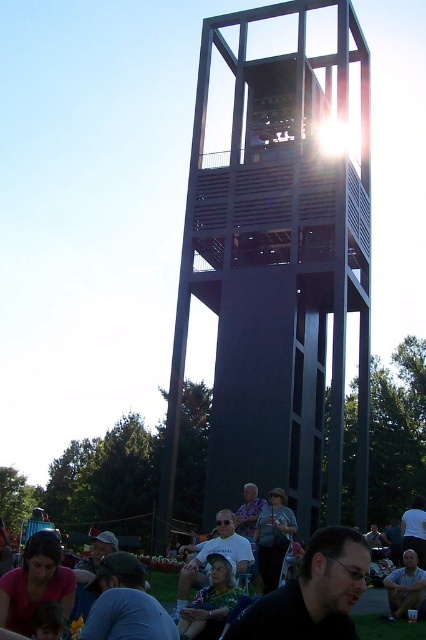
Can you confirm if floral fabric dress at lower center is shorter than matte gray shirt at center?

Yes.

What do you see at coordinates (210, 602) in the screenshot?
I see `floral fabric dress at lower center` at bounding box center [210, 602].

Locate an element on the screen. The height and width of the screenshot is (640, 426). floral fabric dress at lower center is located at coordinates (210, 602).

Is matte pink shirt at lower left to the left of light brown leather jacket at lower right from the viewer's perspective?

Yes, matte pink shirt at lower left is to the left of light brown leather jacket at lower right.

Between matte pink shirt at lower left and light brown leather jacket at lower right, which one has less height?

light brown leather jacket at lower right

What do you see at coordinates (36, 582) in the screenshot? I see `matte pink shirt at lower left` at bounding box center [36, 582].

This screenshot has width=426, height=640. I want to click on matte pink shirt at lower left, so click(36, 582).

Is point (290, 13) closer to viewer compared to point (279, 515)?

That is False.

Does black metal observation tower at center appear on the right side of matte gray shirt at center?

Yes, black metal observation tower at center is to the right of matte gray shirt at center.

The width and height of the screenshot is (426, 640). In order to click on black metal observation tower at center in this screenshot , I will do 276,269.